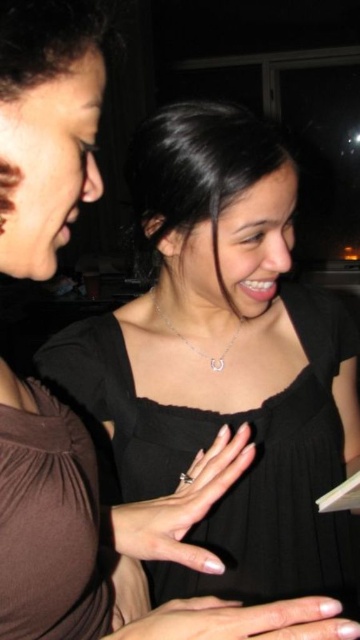
Who is lower down, brown matte dress at lower left or silver metallic necklace at center?

brown matte dress at lower left is lower down.

Is brown matte dress at lower left further to camera compared to silver metallic necklace at center?

No, brown matte dress at lower left is in front of silver metallic necklace at center.

You are a GUI agent. You are given a task and a screenshot of the screen. Output one action in this format:
    pyautogui.click(x=<x>, y=<y>)
    Task: Click on the brown matte dress at lower left
    This screenshot has height=640, width=360.
    Given the screenshot: What is the action you would take?
    pyautogui.click(x=50, y=525)

Is point (222, 564) more distant than point (168, 326)?

That is False.

Does silver metallic ring at center lie in front of silver metallic necklace at center?

Yes, silver metallic ring at center is in front of silver metallic necklace at center.

Image resolution: width=360 pixels, height=640 pixels. I want to click on silver metallic ring at center, so click(x=183, y=506).

Is brown matte dress at lower left closer to camera compared to silver metallic ring at center?

Yes, it is in front of silver metallic ring at center.

Who is taller, brown matte dress at lower left or silver metallic ring at center?

Standing taller between the two is brown matte dress at lower left.

I want to click on brown matte dress at lower left, so click(50, 525).